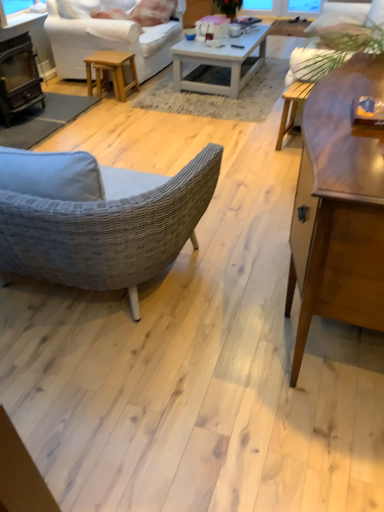
You are a GUI agent. You are given a task and a screenshot of the screen. Output one action in this format:
    pyautogui.click(x=<x>, y=<y>)
    Task: Click on the vacant space to the left of wooden coffee table at center, the 2th coffee table in the top-to-bottom sequence
    This screenshot has height=512, width=384.
    Given the screenshot: What is the action you would take?
    pyautogui.click(x=163, y=347)